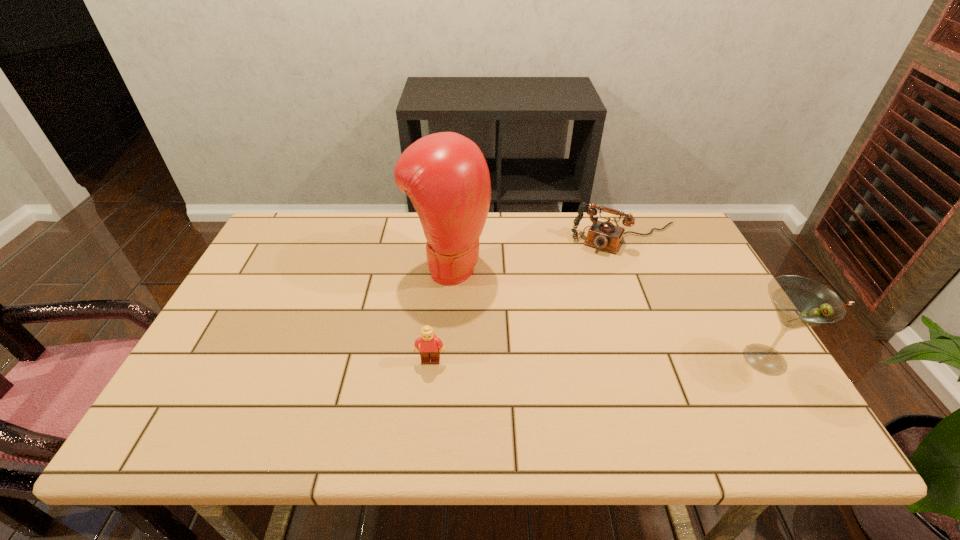
In the image, there is a desktop. Where is `vacant region at the near edge`? vacant region at the near edge is located at coordinates (304, 377).

Find the location of `free space at the right edge`. free space at the right edge is located at coordinates (685, 300).

This screenshot has width=960, height=540. I want to click on free spot at the far left corner of the desktop, so click(301, 217).

Image resolution: width=960 pixels, height=540 pixels. Identify the location of vacant space at the far right corner of the desktop. (645, 220).

Find the location of `free space between the telephone and the Lego`. free space between the telephone and the Lego is located at coordinates click(x=529, y=300).

Locate an element on the screen. Image resolution: width=960 pixels, height=540 pixels. free space between the telephone and the tallest object is located at coordinates (538, 252).

At what (x,y) coordinates should I click in order to perform the action: click on free area in between the telephone and the tallest object. Please return your answer as a coordinate pair (x, y). This screenshot has height=540, width=960. Looking at the image, I should click on (538, 252).

Where is `vacant area that lies between the telephone and the Lego`? Image resolution: width=960 pixels, height=540 pixels. vacant area that lies between the telephone and the Lego is located at coordinates (529, 300).

At what (x,y) coordinates should I click in order to perform the action: click on free area in between the Lego and the tallest object. Please return your answer as a coordinate pair (x, y). The width and height of the screenshot is (960, 540). Looking at the image, I should click on (440, 313).

You are a GUI agent. You are given a task and a screenshot of the screen. Output one action in this format:
    pyautogui.click(x=<x>, y=<y>)
    Task: Click on the free space between the telephone and the Lego
    The height and width of the screenshot is (540, 960).
    Given the screenshot: What is the action you would take?
    pyautogui.click(x=529, y=300)